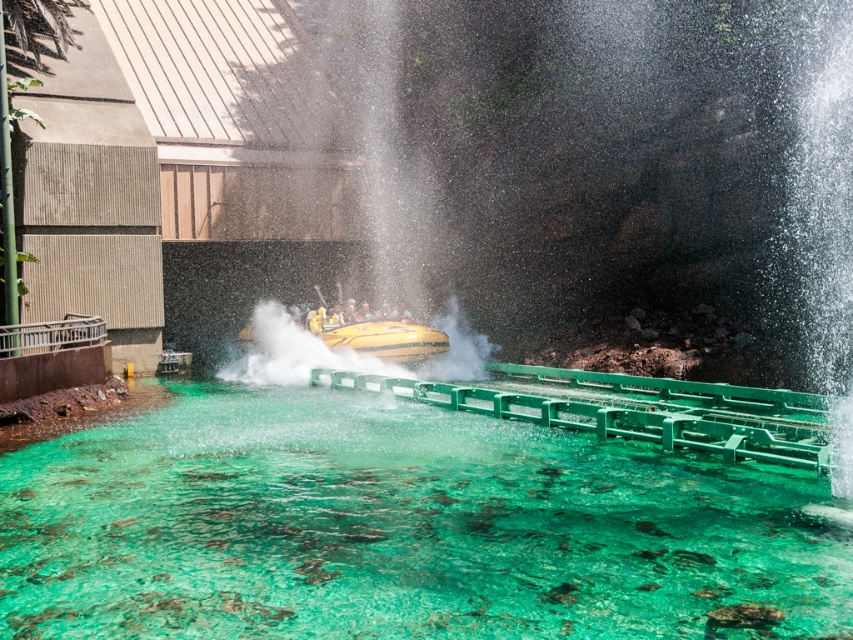
In the scene shown: You are a guest at the amusement park and want to take a photo of the yellow matte raft at center and the yellow rubber boat at center. Which one is on the right side when looking at the scene?

The yellow matte raft at center is positioned on the right side of the yellow rubber boat at center.

You are a ride operator who needs to determine which vessel takes up more space in the image. You see the yellow matte raft at center and the yellow rubber boat at center. Which one is larger in the image?

The yellow rubber boat at center is larger because it occupies more space than the yellow matte raft at center.

You are designing a safety map for the amusement park and need to mark the location of the translucent green water at center. According to the coordinates provided, where exactly should this water feature be placed on the map?

The translucent green water at center should be placed at the coordinates point (403, 529) as specified in the description.